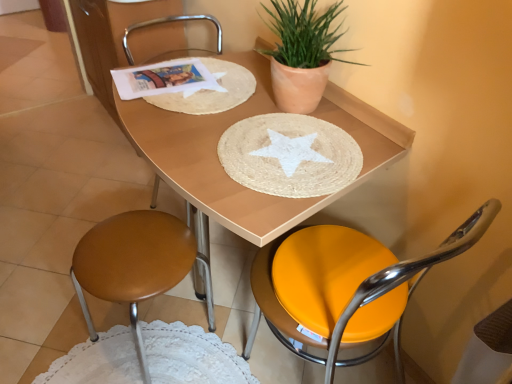
I want to click on space that is in front of white paper at upper left, so click(182, 125).